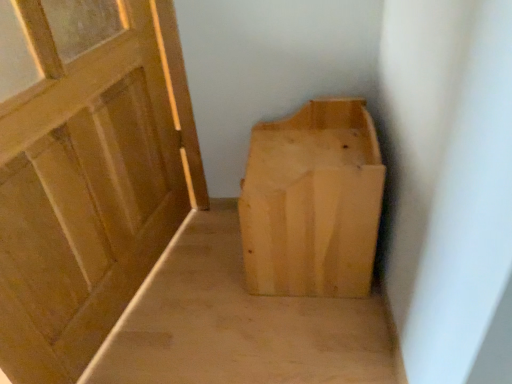
Where is `vacant area that lies in front of light wood/rough textured box at center`? vacant area that lies in front of light wood/rough textured box at center is located at coordinates (300, 334).